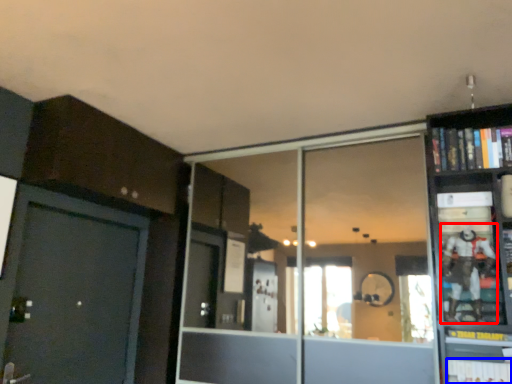
Question: Which point is closer to the camera, toy (highlighted by a red box) or book (highlighted by a blue box)?

Choices:
 (A) toy
 (B) book

Answer: (B)